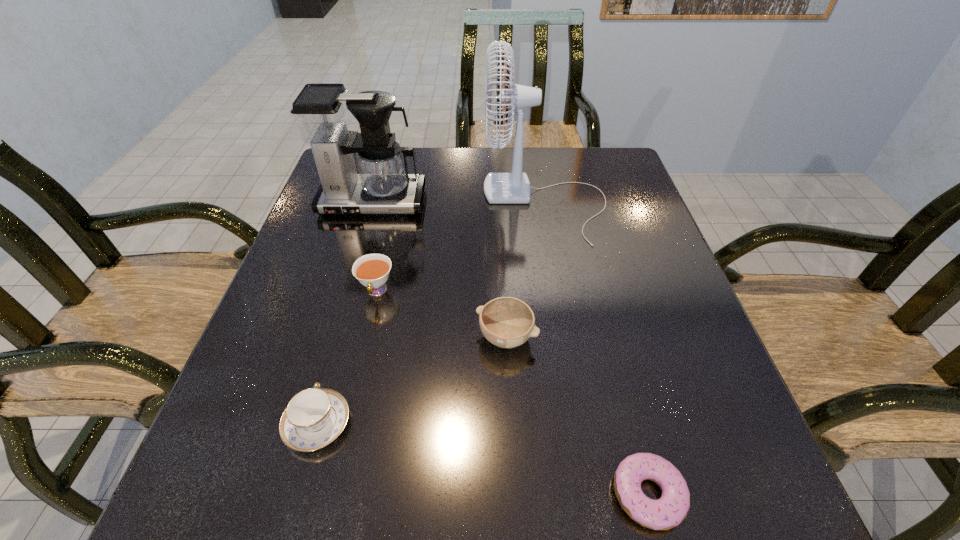
At what (x,y) coordinates should I click in order to perform the action: click on coffee maker situated at the far edge. Please return your answer as a coordinate pair (x, y). Looking at the image, I should click on (322, 113).

The height and width of the screenshot is (540, 960). Find the location of `object that is at the near edge`. object that is at the near edge is located at coordinates (671, 509).

The height and width of the screenshot is (540, 960). In order to click on coffee maker located in the left edge section of the desktop in this screenshot , I will do `click(322, 113)`.

I want to click on teacup located at the left edge, so click(x=315, y=417).

At what (x,y) coordinates should I click in order to perform the action: click on fan positioned at the right edge. Please return your answer as a coordinate pair (x, y). The height and width of the screenshot is (540, 960). Looking at the image, I should click on (513, 187).

Image resolution: width=960 pixels, height=540 pixels. In order to click on doughnut positioned at the right edge in this screenshot , I will do `click(671, 509)`.

Where is `object that is at the far left corner`? The image size is (960, 540). object that is at the far left corner is located at coordinates (322, 113).

Where is `object present at the far right corner`? The width and height of the screenshot is (960, 540). object present at the far right corner is located at coordinates (513, 187).

This screenshot has width=960, height=540. In order to click on object at the near right corner in this screenshot , I will do `click(671, 509)`.

Where is `vacant space at the far edge of the desktop`? The height and width of the screenshot is (540, 960). vacant space at the far edge of the desktop is located at coordinates (413, 173).